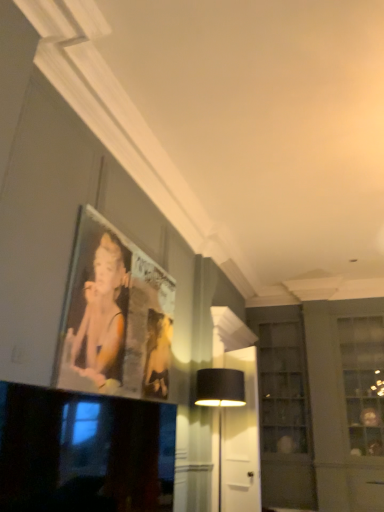
Question: From their relative heights in the image, would you say metallic silver picture frame at upper left is taller or shorter than black glossy television at lower left?

Choices:
 (A) tall
 (B) short

Answer: (A)

Question: Is metallic silver picture frame at upper left to the left or to the right of black glossy television at lower left in the image?

Choices:
 (A) right
 (B) left

Answer: (B)

Question: Which object is the closest to the black fabric table lamp at center?

Choices:
 (A) clear glass cabinet at center right
 (B) metallic silver picture frame at upper left
 (C) black glossy television at lower left

Answer: (B)

Question: Which object is positioned closest to the black glossy television at lower left?

Choices:
 (A) clear glass cabinet at center right
 (B) metallic silver picture frame at upper left
 (C) black fabric table lamp at center

Answer: (B)